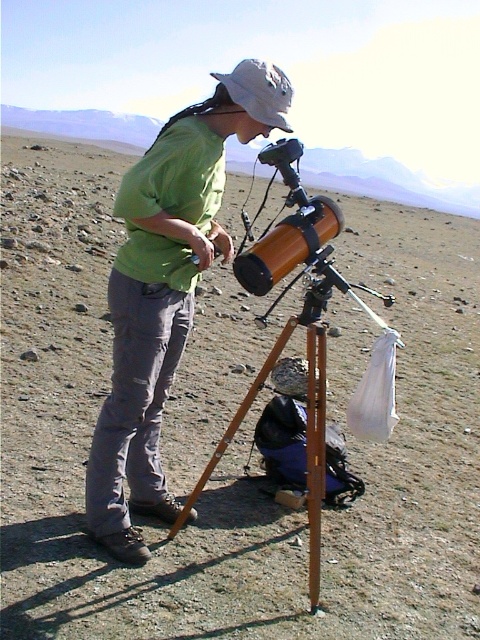
Does green matte shirt at center have a larger size compared to wooden tripod at center?

Correct, green matte shirt at center is larger in size than wooden tripod at center.

Which is more to the left, green matte shirt at center or wooden tripod at center?

Positioned to the left is green matte shirt at center.

Is point (116, 212) closer to camera compared to point (323, 326)?

Yes, it is.

The height and width of the screenshot is (640, 480). I want to click on green matte shirt at center, so click(166, 291).

Can you confirm if green matte shirt at center is smaller than white fabric baseball hat at upper center?

Incorrect, green matte shirt at center is not smaller in size than white fabric baseball hat at upper center.

Between green matte shirt at center and white fabric baseball hat at upper center, which one has more height?

Standing taller between the two is green matte shirt at center.

Which is in front, point (144, 435) or point (260, 83)?

Point (260, 83) is in front.

Locate an element on the screen. green matte shirt at center is located at coordinates (166, 291).

Does wooden tripod at center have a smaller size compared to white fabric baseball hat at upper center?

Correct, wooden tripod at center occupies less space than white fabric baseball hat at upper center.

Which is above, wooden tripod at center or white fabric baseball hat at upper center?

white fabric baseball hat at upper center

Where is `wooden tripod at center`? The image size is (480, 640). wooden tripod at center is located at coordinates (307, 390).

The height and width of the screenshot is (640, 480). In order to click on wooden tripod at center in this screenshot , I will do `click(307, 390)`.